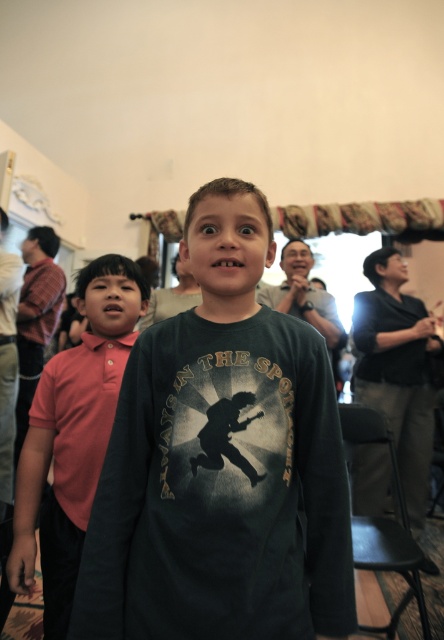
Question: Among these points, which one is nearest to the camera?

Choices:
 (A) (238, 540)
 (B) (95, 476)
 (C) (59, 358)

Answer: (A)

Question: Which object is positioned farthest from the pink cotton polo shirt at left?

Choices:
 (A) red cotton polo shirt at left
 (B) dark green long-sleeve shirt at center

Answer: (B)

Question: Among these points, which one is farthest from the camera?

Choices:
 (A) (100, 353)
 (B) (241, 250)

Answer: (A)

Question: Can you confirm if dark green long-sleeve shirt at center is wider than pink cotton polo shirt at left?

Choices:
 (A) yes
 (B) no

Answer: (A)

Question: From the image, what is the correct spatial relationship of pink cotton polo shirt at left in relation to red cotton polo shirt at left?

Choices:
 (A) left
 (B) right

Answer: (A)

Question: Can you confirm if pink cotton polo shirt at left is positioned above red cotton polo shirt at left?

Choices:
 (A) no
 (B) yes

Answer: (A)